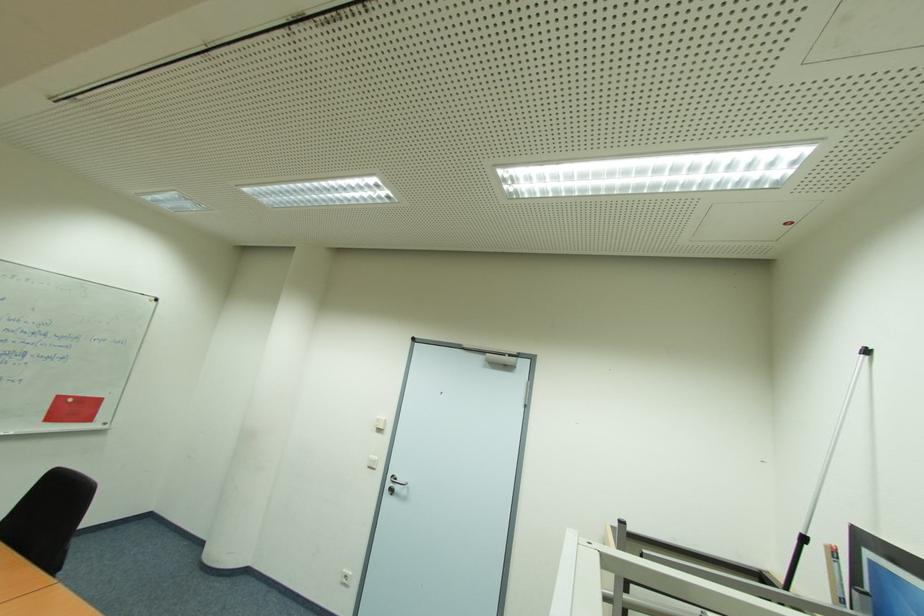
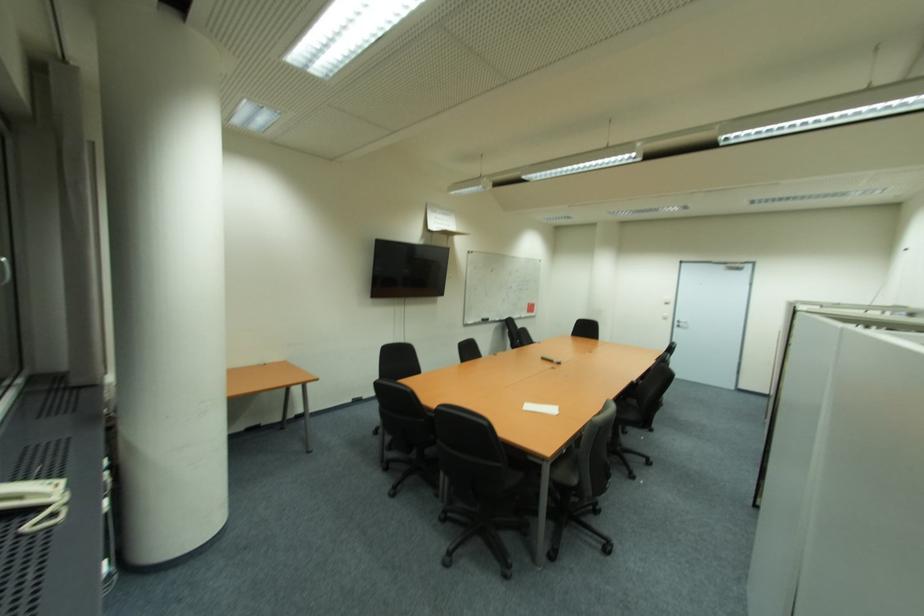
Find the pixel in the second image that matches pixel 399 488 in the first image.

(686, 325)